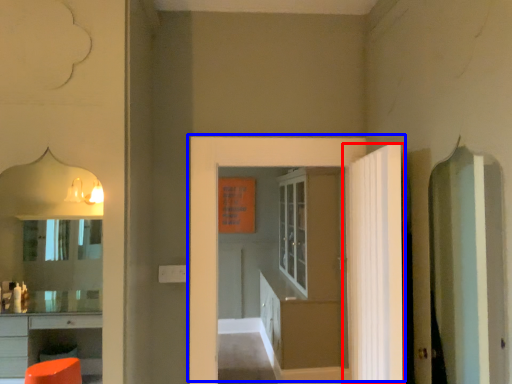
Question: Which of the following is the closest to the observer, door (highlighted by a red box) or door (highlighted by a blue box)?

Choices:
 (A) door
 (B) door

Answer: (A)